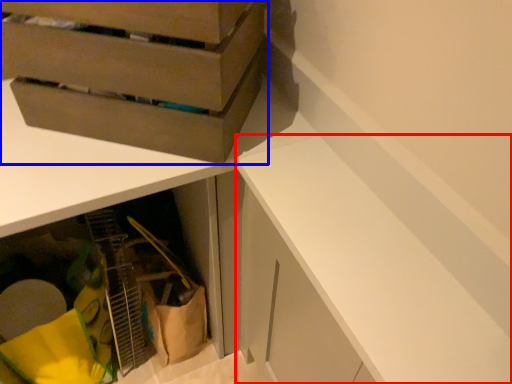
Question: Which object appears closest to the camera in this image, cabinetry (highlighted by a red box) or cardboard box (highlighted by a blue box)?

Choices:
 (A) cabinetry
 (B) cardboard box

Answer: (A)